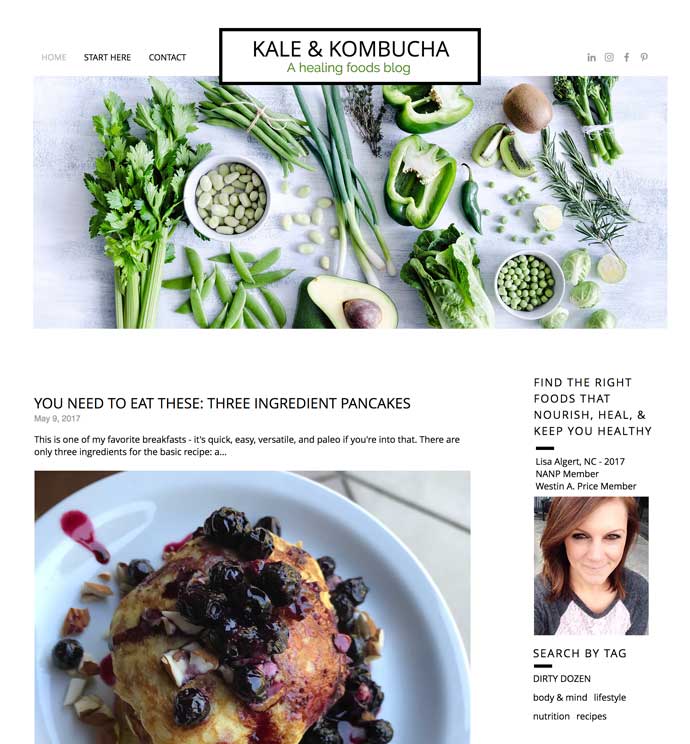
The image size is (690, 744). I want to click on plate, so click(426, 687).